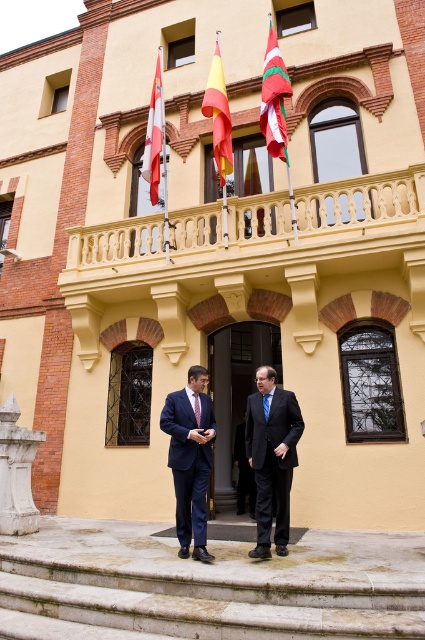
Question: Is stone steps at center positioned in front of white stone pillar at lower left?

Choices:
 (A) no
 (B) yes

Answer: (B)

Question: Which point appears farthest from the camera in this image?

Choices:
 (A) (246, 582)
 (B) (266, 67)

Answer: (B)

Question: From the image, what is the correct spatial relationship of smooth beige balcony at upper center in relation to brushed metal tie at center?

Choices:
 (A) below
 (B) above

Answer: (B)

Question: Where is blue suit at center located in relation to white stone pillar at lower left in the image?

Choices:
 (A) below
 (B) above

Answer: (B)

Question: Which of the following is the closest to the observer?

Choices:
 (A) (31, 516)
 (B) (295, 436)
 (C) (156, 147)

Answer: (B)

Question: Which object appears farthest from the camera in this image?

Choices:
 (A) dark blue suit at center
 (B) smooth beige balcony at upper center
 (C) stone steps at center
 (D) brushed metal tie at center

Answer: (B)